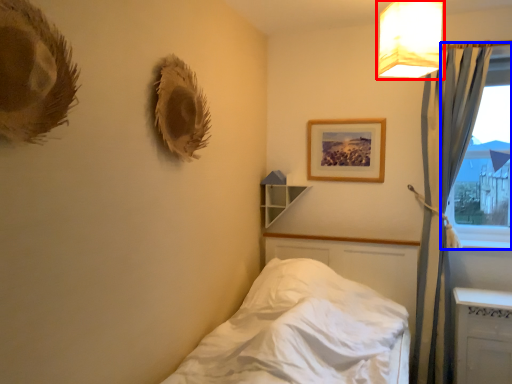
Question: Which of the following is the closest to the observer, lamp (highlighted by a red box) or window (highlighted by a blue box)?

Choices:
 (A) lamp
 (B) window

Answer: (A)